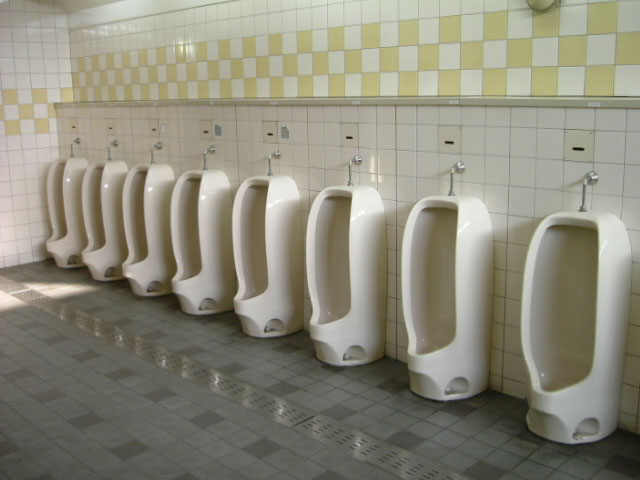
Where is `urinals`? The width and height of the screenshot is (640, 480). urinals is located at coordinates (59, 210), (100, 230), (148, 226), (196, 246), (269, 258), (332, 262), (436, 291), (571, 322).